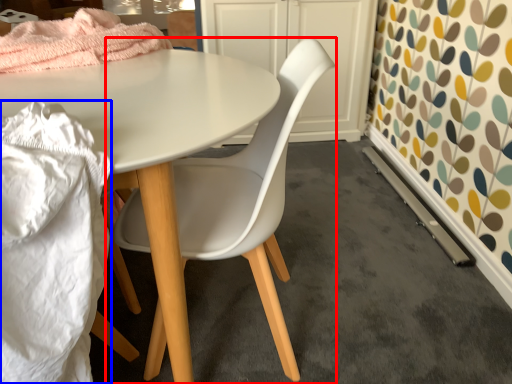
Question: Which point is closer to the camera, chair (highlighted by a red box) or material (highlighted by a blue box)?

Choices:
 (A) chair
 (B) material

Answer: (B)